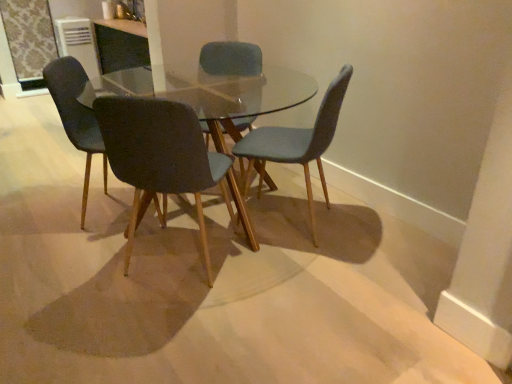
Image resolution: width=512 pixels, height=384 pixels. I want to click on vacant area in front of clear glass table at center, so click(x=205, y=314).